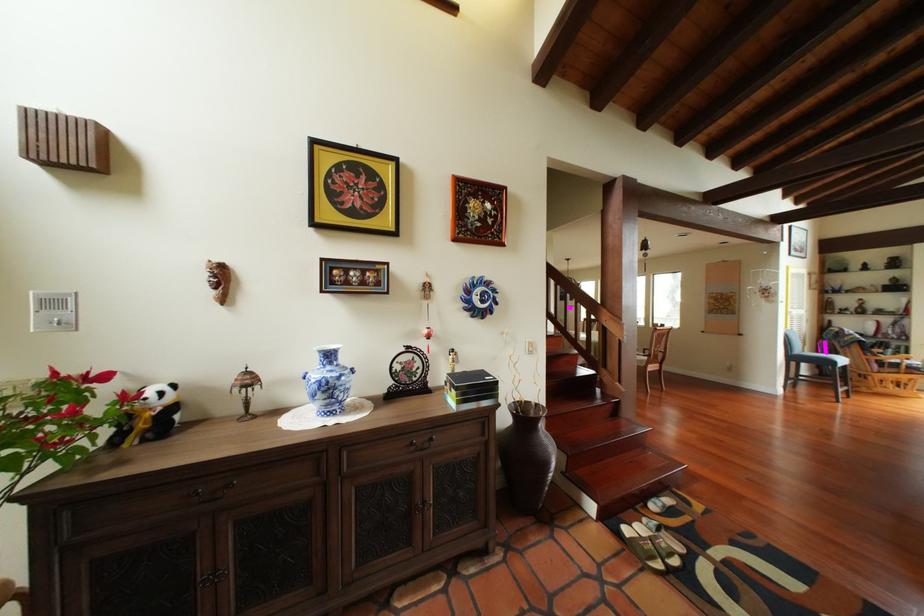
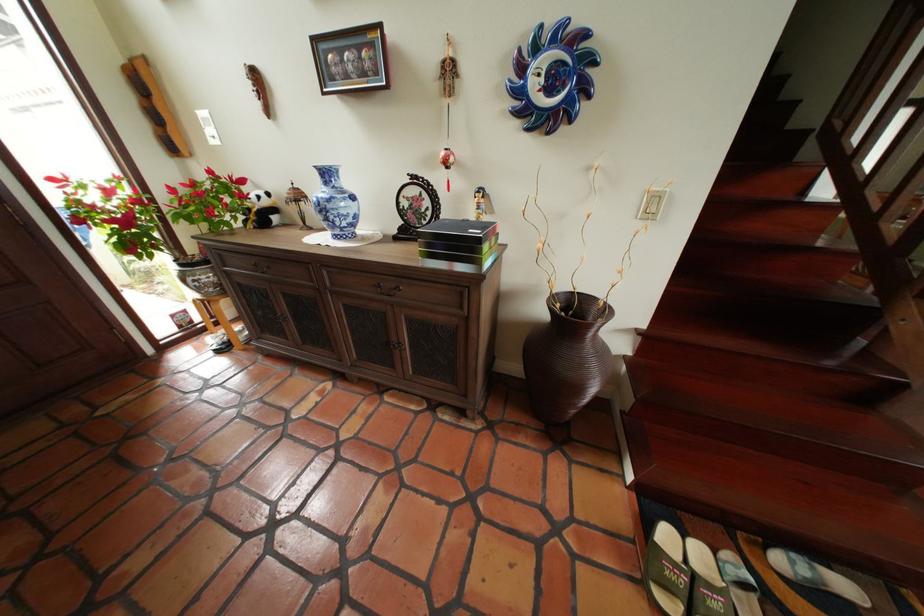
Where in the second image is the point corresponding to the point at 541,352 from the first image?

(658, 213)